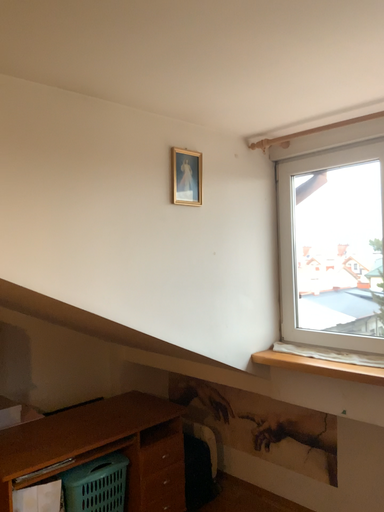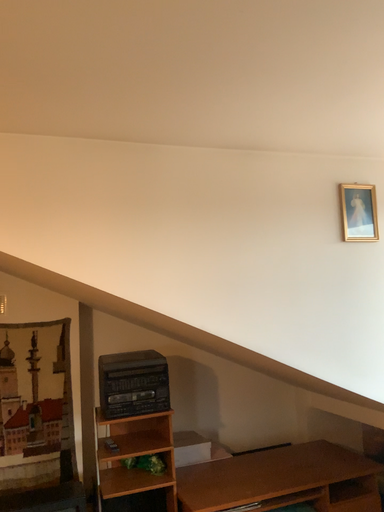
Question: How did the camera likely rotate when shooting the video?

Choices:
 (A) rotated right
 (B) rotated left

Answer: (B)